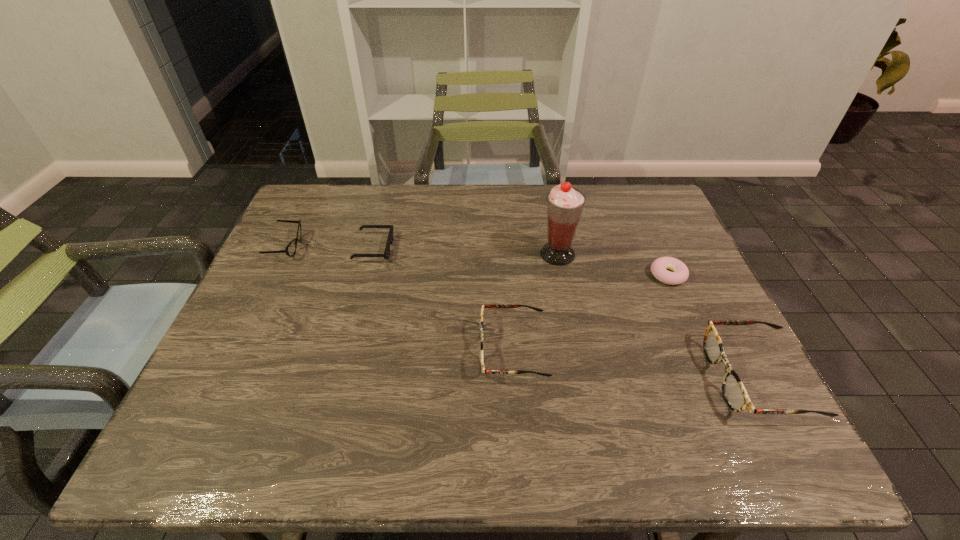
This screenshot has height=540, width=960. What are the coordinates of `blank region between the tallest object and the tallest spectacles` in the screenshot? It's located at (657, 316).

The width and height of the screenshot is (960, 540). In order to click on empty location between the sunglasses and the fifth shortest object in this screenshot , I will do `click(564, 313)`.

The height and width of the screenshot is (540, 960). What are the coordinates of `free spot between the second spectacles from left to right and the second tallest object` in the screenshot? It's located at (635, 364).

I want to click on free spot between the second tallest object and the shortest spectacles, so click(x=521, y=313).

The image size is (960, 540). Find the location of `empty space that is in between the tallest object and the second spectacles from right to left`. empty space that is in between the tallest object and the second spectacles from right to left is located at coordinates (535, 302).

Identify the location of vacant space in between the second object from left to right and the tallest spectacles. (564, 313).

Find the location of a particular element. This screenshot has width=960, height=540. blank region between the fourth object from right to left and the tallest spectacles is located at coordinates (635, 364).

The height and width of the screenshot is (540, 960). I want to click on vacant area that lies between the leftmost spectacles and the rightmost spectacles, so click(x=521, y=313).

Choose which object is the fourth nearest neighbor to the tallest spectacles. Please provide its 2D coordinates. Your answer should be formatted as a tuple, i.e. [(x, y)], where the tuple contains the x and y coordinates of a point satisfying the conditions above.

[(386, 254)]

You are a GUI agent. You are given a task and a screenshot of the screen. Output one action in this format:
    pyautogui.click(x=<x>, y=<y>)
    Task: Click on the object that is the third closest to the second spectacles from left to right
    The image size is (960, 540).
    Given the screenshot: What is the action you would take?
    pyautogui.click(x=680, y=274)